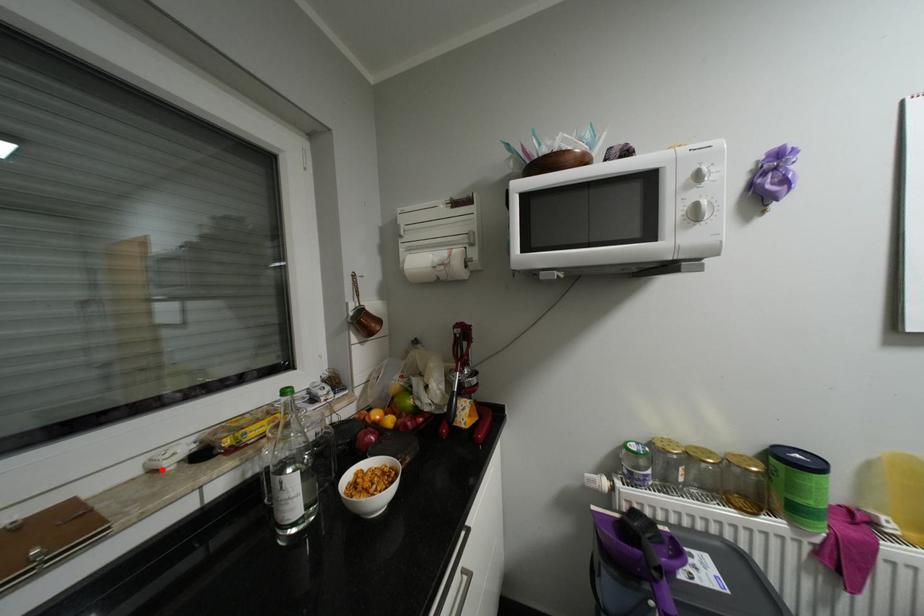
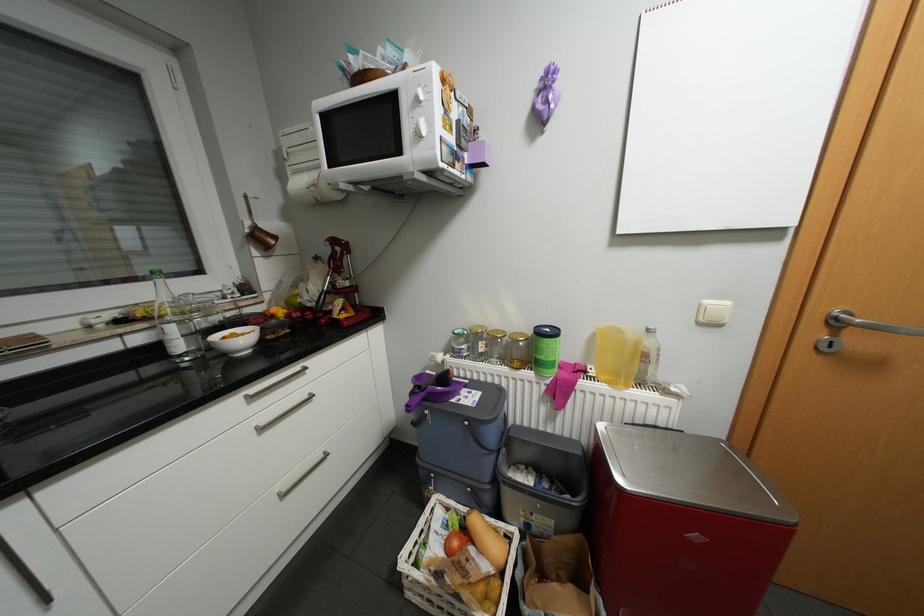
Find the pixel in the second image that matches the highlighted location in the first image.

(96, 326)